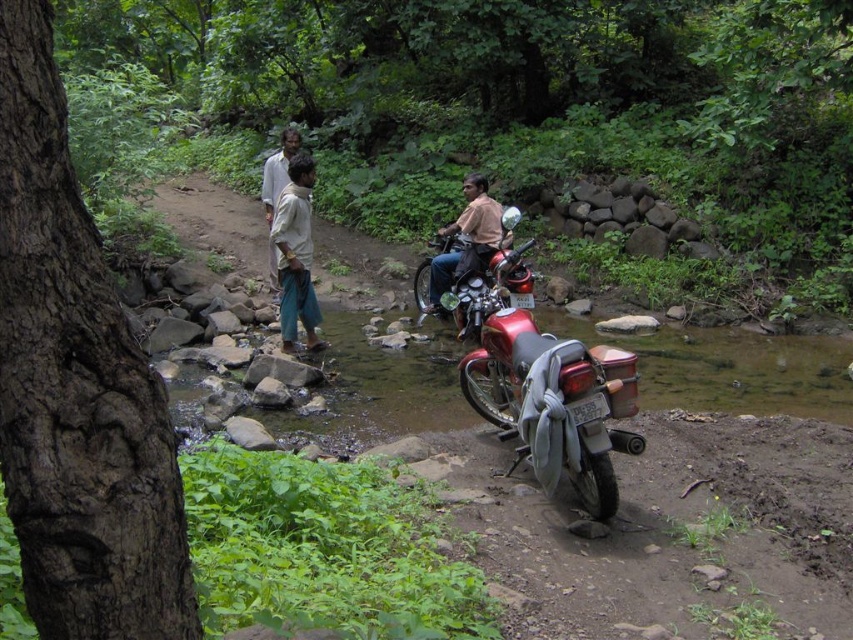
You are a hiker who needs to pass between the light beige fabric pants at center and the brown leather jacket at center. The path between them is narrow. If your backpack is 2 feet wide, can you fit through the space between them?

The distance between the light beige fabric pants at center and the brown leather jacket at center is 5.90 feet. Subtracting the width of your backpack, which is 2 feet, there would still be 3.90 feet of space remaining. Therefore, you can safely pass through the gap between them.

You are navigating through the forest and need to reach a hidden treasure located at point B. You are currently at point A. According to the map, point A is at coordinates point (x=637, y=435) and point B is at coordinates point (x=310, y=164). Which direction should you move to get closer to point B?

To reach point B from point A, you should move backward since point A is in front of point B according to the map.

You are standing at the center of the image and want to locate the light beige fabric pants at center. Which direction should you look to find them?

The light beige fabric pants at center are located at the center of the image, so you should look straight ahead to find them.